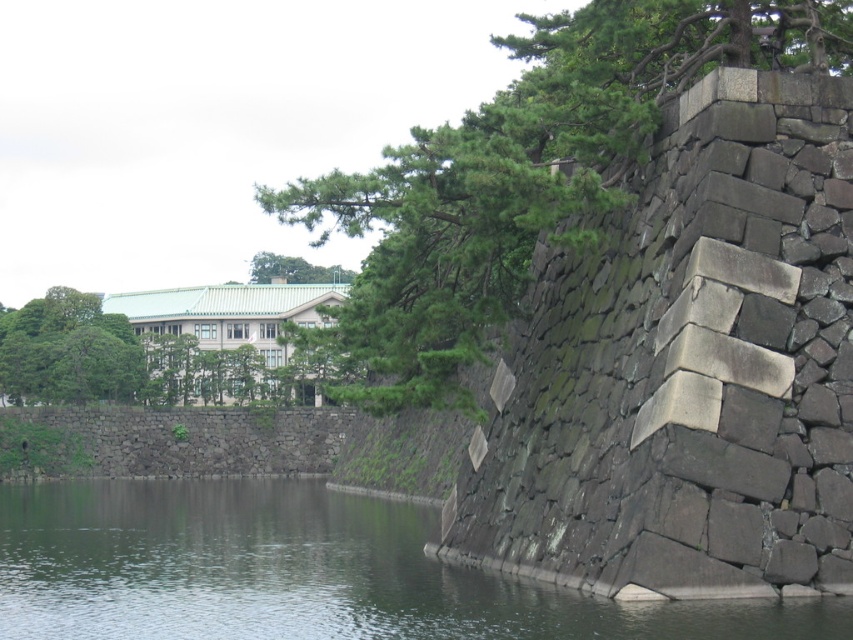
Question: Estimate the real-world distances between objects in this image. Which object is farther from the green leafy tree at upper center?

Choices:
 (A) green leafy tree at upper left
 (B) green stone wall at lower left
 (C) green leafy tree at upper right

Answer: (B)

Question: Is green stone wall at lower left smaller than green leafy tree at upper left?

Choices:
 (A) no
 (B) yes

Answer: (A)

Question: Which point is closer to the camera taking this photo?

Choices:
 (A) (680, 48)
 (B) (0, 528)
 (C) (120, 330)

Answer: (A)

Question: In this image, where is green leafy tree at upper right located relative to green stone wall at lower left?

Choices:
 (A) left
 (B) right

Answer: (B)

Question: Which is nearer to the green stone wall at lower left?

Choices:
 (A) green leafy tree at upper left
 (B) green leafy tree at upper right

Answer: (B)

Question: Does green leafy tree at upper right appear under green stone wall at lower left?

Choices:
 (A) no
 (B) yes

Answer: (A)